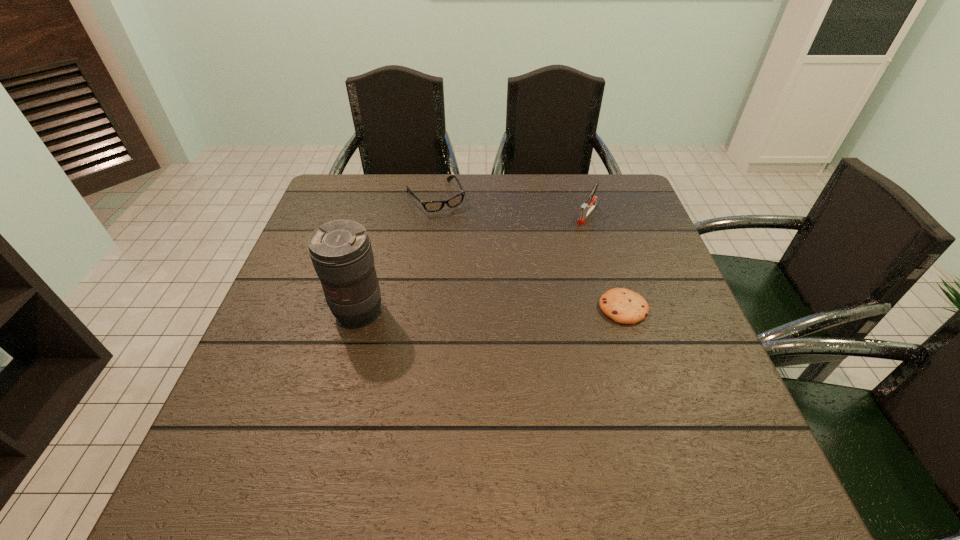
Where is `unoccupied area between the second tallest object and the tallest object`? unoccupied area between the second tallest object and the tallest object is located at coordinates (473, 263).

The height and width of the screenshot is (540, 960). Find the location of `free space between the cookie and the third shortest object`. free space between the cookie and the third shortest object is located at coordinates (606, 261).

Identify the location of free space between the second tallest object and the cookie. This screenshot has height=540, width=960. pyautogui.click(x=606, y=261).

You are a GUI agent. You are given a task and a screenshot of the screen. Output one action in this format:
    pyautogui.click(x=<x>, y=<y>)
    Task: Click on the free space between the spectacles and the telephoto lens
    Image resolution: width=960 pixels, height=540 pixels.
    Given the screenshot: What is the action you would take?
    pyautogui.click(x=396, y=254)

This screenshot has width=960, height=540. In order to click on the third closest object relative to the second tallest object in this screenshot , I will do `click(341, 252)`.

Find the location of `the second closest object to the tallest object`. the second closest object to the tallest object is located at coordinates (624, 306).

At what (x,y) coordinates should I click in order to perform the action: click on vacant space that satisfies the following two spatial constraints: 1. on the front side of the second tallest object; 2. on the left side of the shortest object. Please return your answer as a coordinate pair (x, y). Looking at the image, I should click on (615, 308).

At what (x,y) coordinates should I click in order to perform the action: click on free space that satisfies the following two spatial constraints: 1. on the front side of the spectacles; 2. on the right side of the second tallest object. Please return your answer as a coordinate pair (x, y). Looking at the image, I should click on (433, 214).